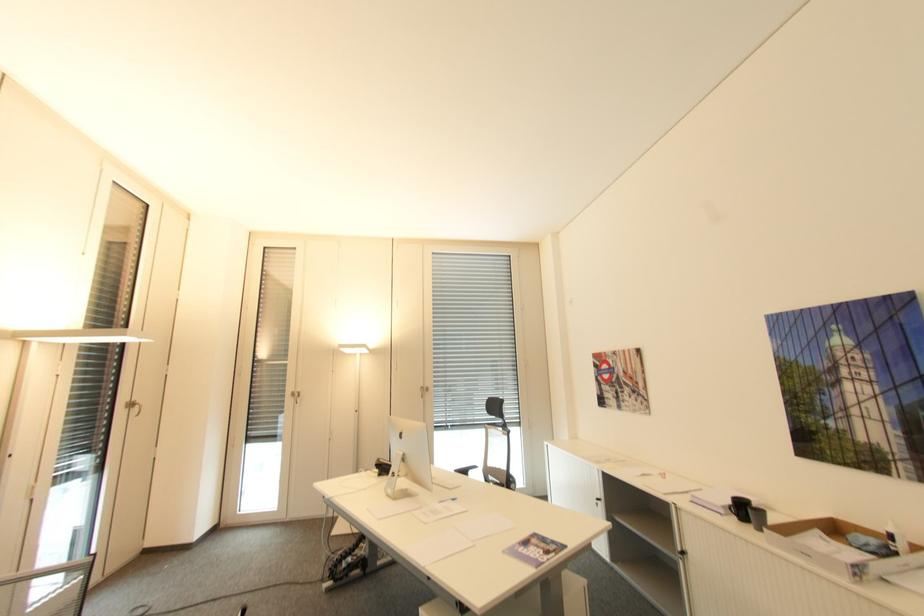
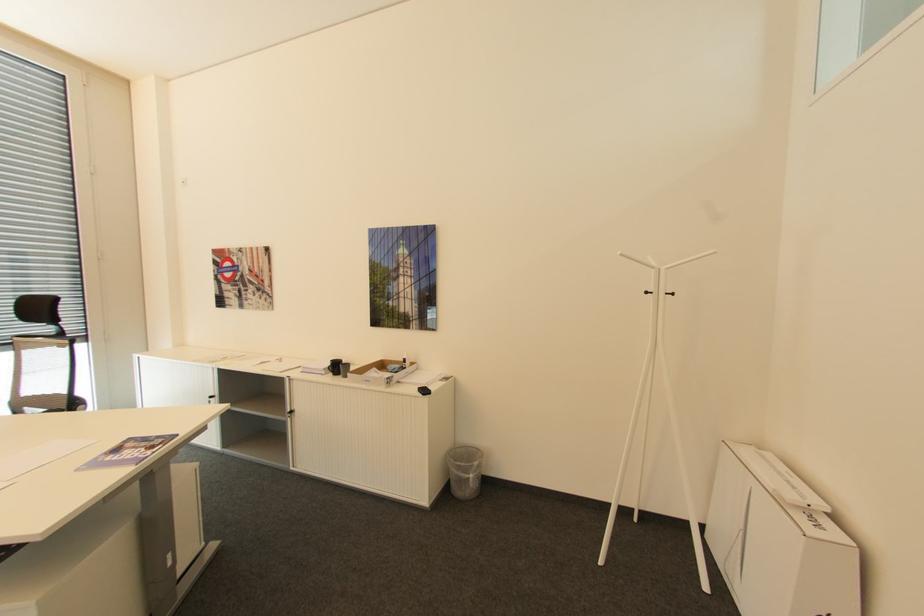
Question: Based on the continuous images, in which direction is the camera rotating? Reply with the corresponding letter.

Choices:
 (A) Left
 (B) Right
 (C) Up
 (D) Down

Answer: (B)